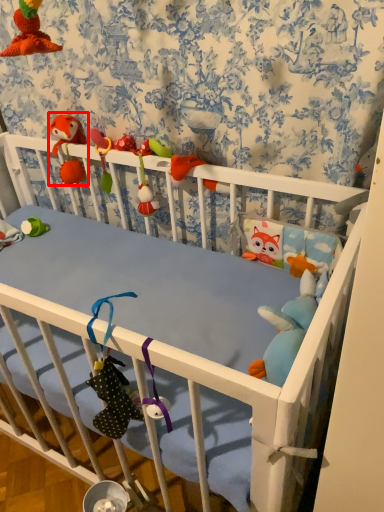
Question: From the image's perspective, what is the correct spatial relationship of toy (annotated by the red box) in relation to toy?

Choices:
 (A) below
 (B) above

Answer: (B)